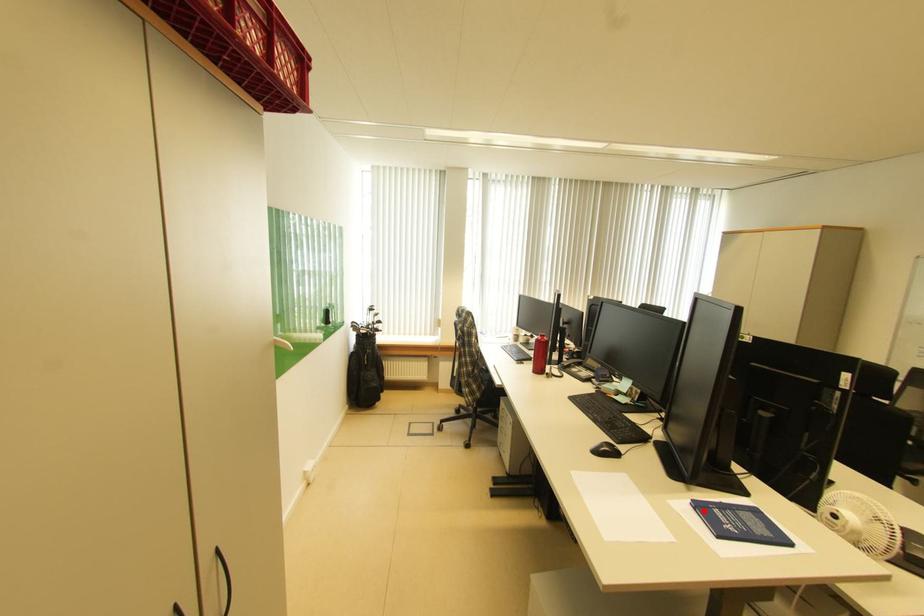
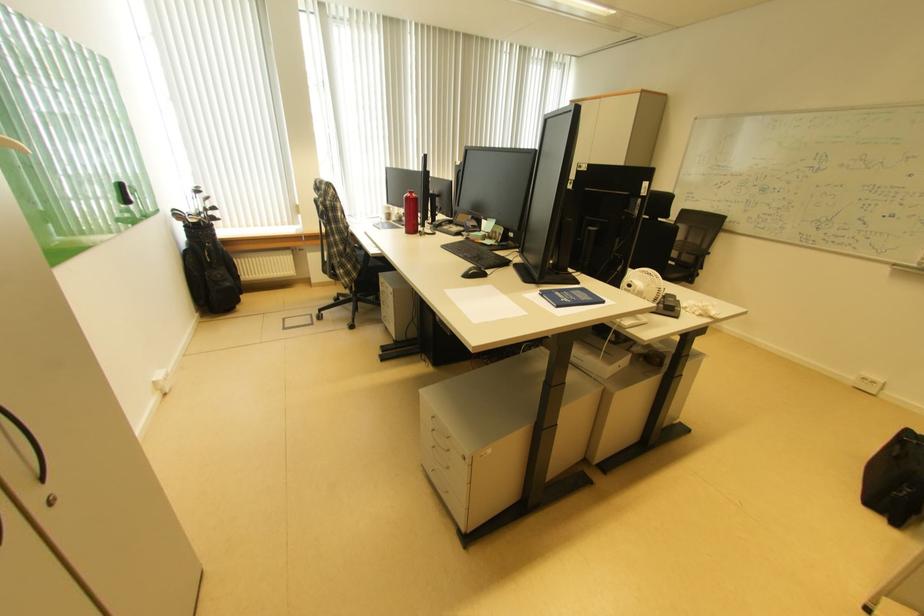
Where in the second image is the point corresponding to the highlighted location from the first image?

(551, 297)